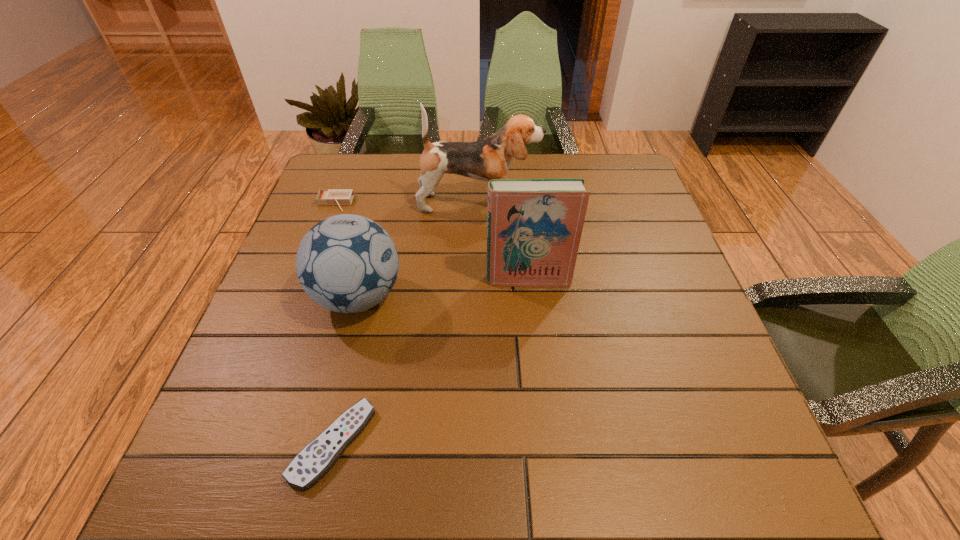
The width and height of the screenshot is (960, 540). I want to click on vacant space situated on the right of the shortest object, so click(564, 443).

The image size is (960, 540). In order to click on puppy present at the far edge in this screenshot , I will do `click(490, 158)`.

Where is `matchbox positioned at the far edge`? matchbox positioned at the far edge is located at coordinates (339, 197).

Find the location of `object at the near edge`. object at the near edge is located at coordinates (316, 458).

What are the coordinates of `soccer ball positioned at the left edge` in the screenshot? It's located at (346, 263).

Locate an element on the screen. The width and height of the screenshot is (960, 540). matchbox that is positioned at the left edge is located at coordinates point(339,197).

Where is `remote control at the left edge`? remote control at the left edge is located at coordinates (316, 458).

Locate an element on the screen. The height and width of the screenshot is (540, 960). object that is at the far left corner is located at coordinates (339, 197).

This screenshot has width=960, height=540. Identify the location of object that is at the near left corner. (316, 458).

The width and height of the screenshot is (960, 540). Identify the location of vacant region at the far edge of the desktop. (464, 184).